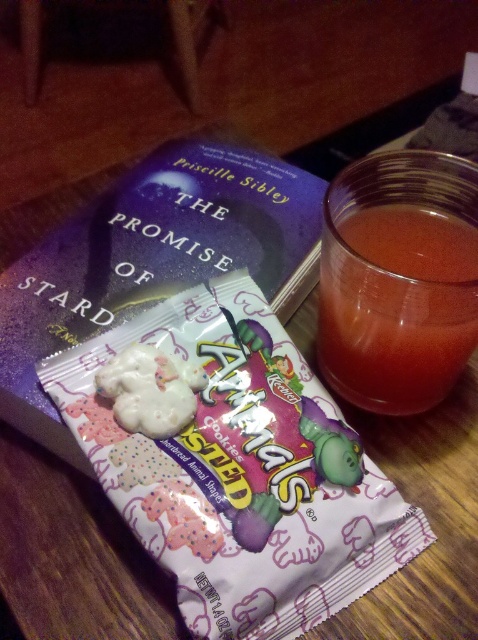
What is located at the point with coordinates (237, 467) in the image?

The white frosted animal cookies at center are located at point (237, 467).

You are organizing a childrens party and have both the purple matte hardcover book at center and the translucent glass at upper right. Which item should you choose to place under a birthday cake to prevent it from sliding on the table? Explain your choice based on their sizes.

The purple matte hardcover book at center is bigger than the translucent glass at upper right, so it would provide a more stable and larger surface to place under the birthday cake, preventing it from sliding.